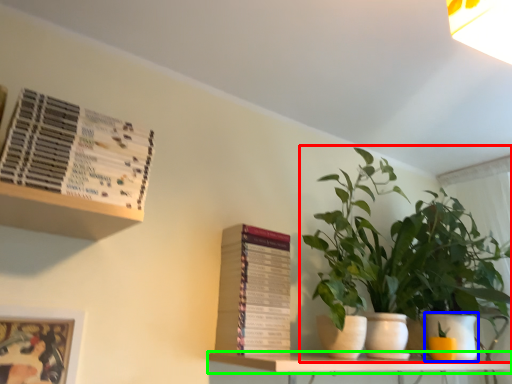
Question: Which object is the closest to the houseplant (highlighted by a red box)? Choose among these: flowerpot (highlighted by a blue box) or shelf (highlighted by a green box).

Choices:
 (A) flowerpot
 (B) shelf

Answer: (A)